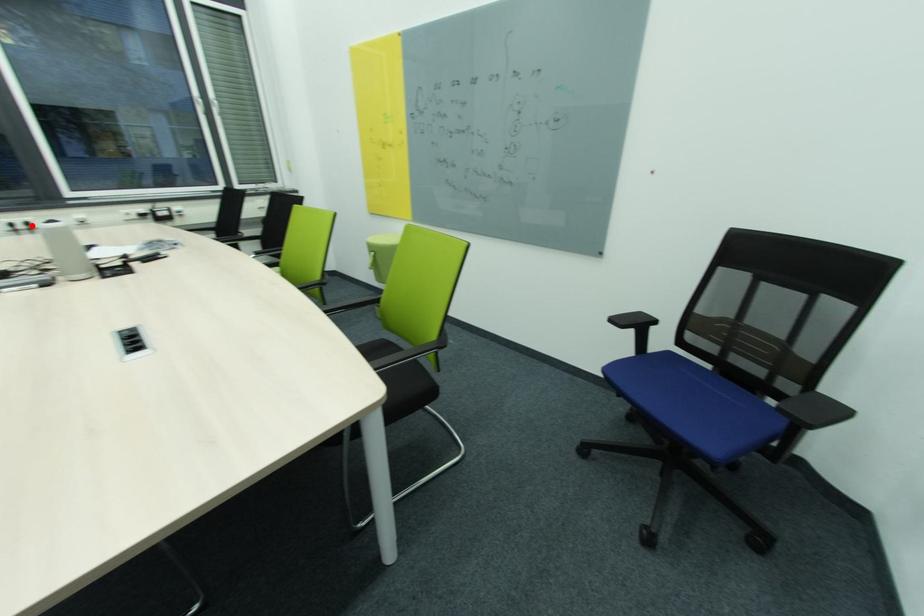
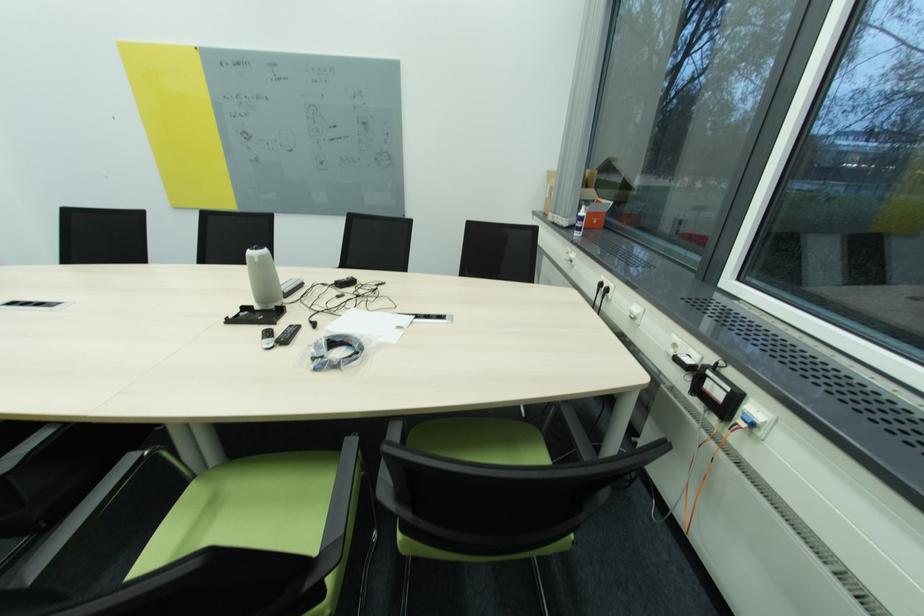
Question: A red point is marked in image1. In image2, is the corresponding 3D point closer to the camera or farther? Reply with the corresponding letter.

Choices:
 (A) The corresponding 3D point is closer.
 (B) The corresponding 3D point is farther.

Answer: (A)